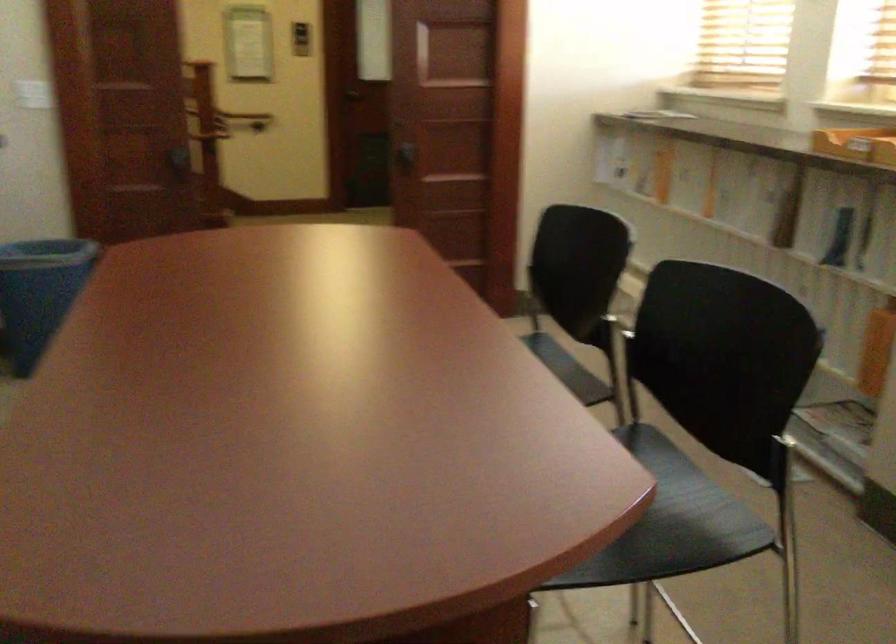
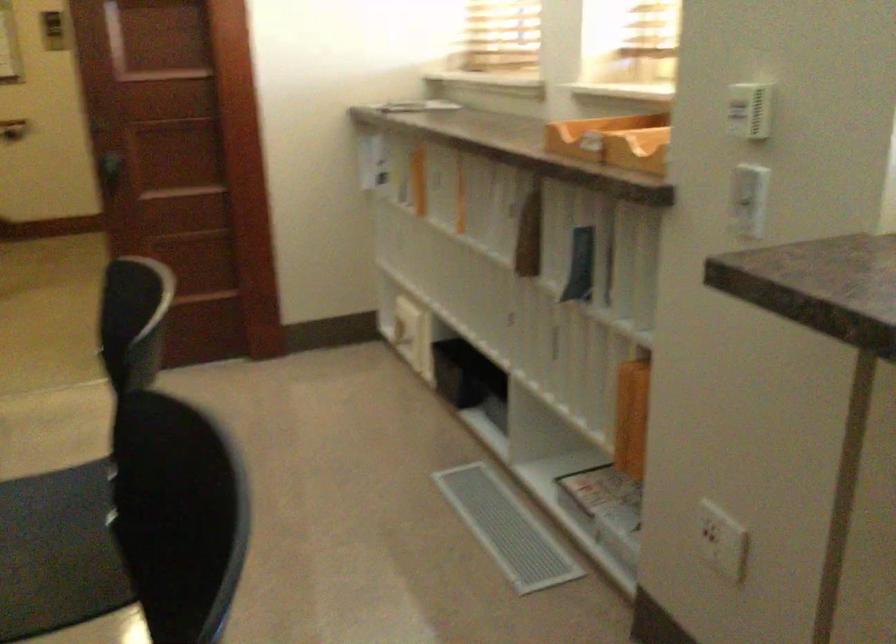
Which direction would the cameraman need to move to produce the second image?

The cameraman moved toward right, forward.